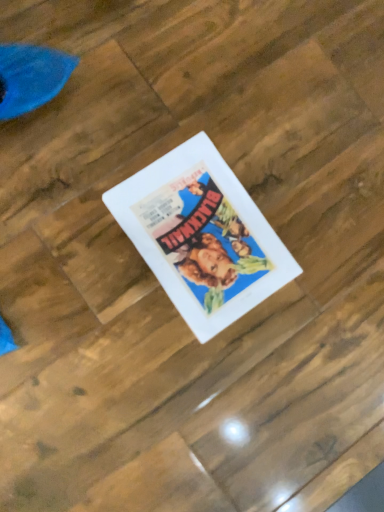
The width and height of the screenshot is (384, 512). Find the location of `blank space situated above white paper at center (from a real-world perspective)`. blank space situated above white paper at center (from a real-world perspective) is located at coordinates (206, 234).